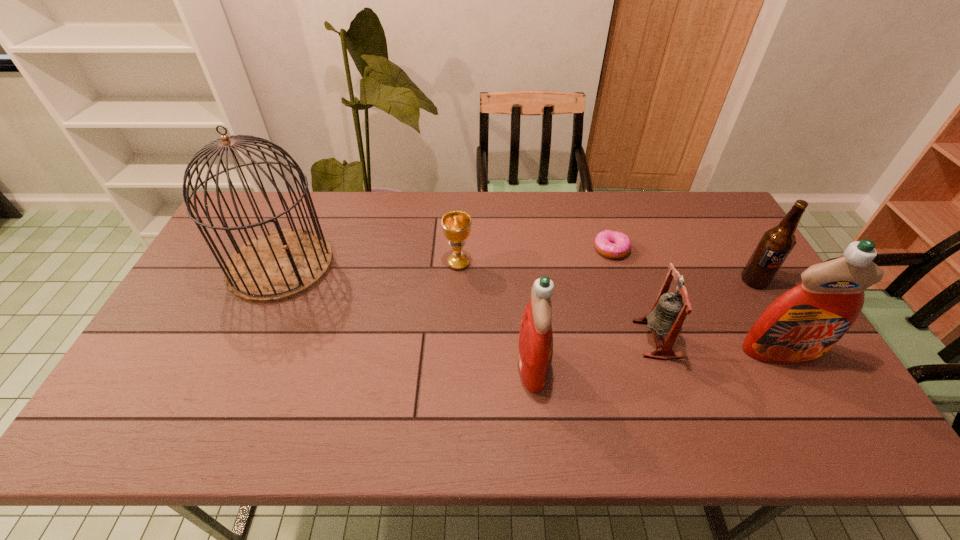
Image resolution: width=960 pixels, height=540 pixels. In order to click on the shorter detergent in this screenshot , I will do `click(535, 348)`.

I want to click on the third object from left to right, so click(x=535, y=348).

I want to click on the taller detergent, so click(x=801, y=325).

The width and height of the screenshot is (960, 540). In order to click on the right detergent in this screenshot , I will do `click(801, 325)`.

This screenshot has height=540, width=960. In order to click on the sixth object from right to left in this screenshot , I will do `click(456, 224)`.

Locate an element on the screen. This screenshot has height=540, width=960. chalice is located at coordinates (456, 224).

At what (x,y) coordinates should I click in order to perform the action: click on the shortest object. Please return your answer as a coordinate pair (x, y). Image resolution: width=960 pixels, height=540 pixels. Looking at the image, I should click on (611, 244).

Find the location of a particular element. The width and height of the screenshot is (960, 540). the tallest object is located at coordinates (279, 265).

Where is `the leftmost object`? The width and height of the screenshot is (960, 540). the leftmost object is located at coordinates (279, 265).

Find the location of a particular element. This screenshot has height=540, width=960. beer bottle is located at coordinates (776, 244).